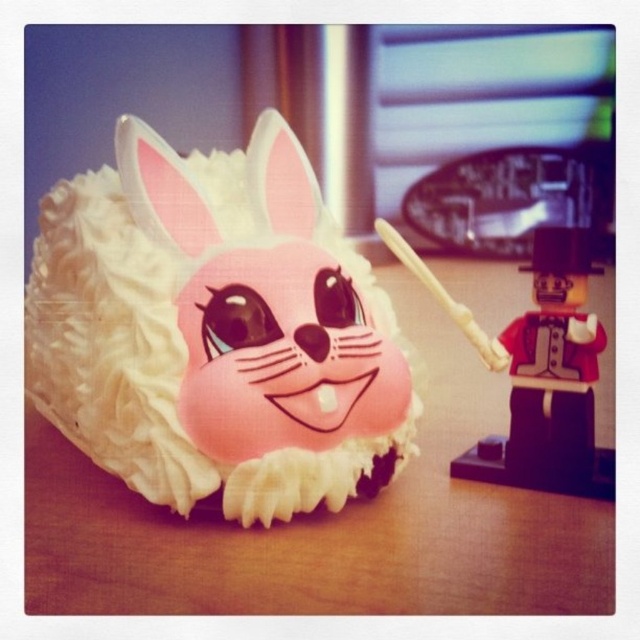
Question: Is pink frosted cake at center positioned behind smooth plastic toy soldier at right?

Choices:
 (A) yes
 (B) no

Answer: (B)

Question: Which of the following is the closest to the observer?

Choices:
 (A) smooth plastic toy soldier at right
 (B) pink frosted cake at center

Answer: (B)

Question: Is pink frosted cake at center thinner than smooth plastic toy soldier at right?

Choices:
 (A) no
 (B) yes

Answer: (A)

Question: Among these objects, which one is farthest from the camera?

Choices:
 (A) smooth plastic toy soldier at right
 (B) pink frosted cake at center

Answer: (A)

Question: Can you confirm if pink frosted cake at center is thinner than smooth plastic toy soldier at right?

Choices:
 (A) yes
 (B) no

Answer: (B)